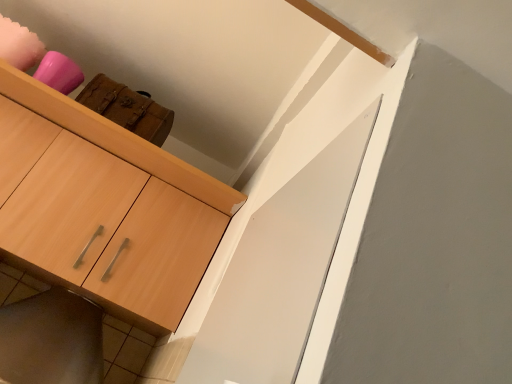
What do you see at coordinates (110, 212) in the screenshot?
I see `light wood cabinet at upper left` at bounding box center [110, 212].

This screenshot has height=384, width=512. I want to click on light wood cabinet at upper left, so click(110, 212).

At what (x,y) coordinates should I click in order to perform the action: click on wooden cabinet at lower left. Please return your answer as a coordinate pair (x, y). Looking at the image, I should click on (124, 351).

Describe the element at coordinates (124, 351) in the screenshot. The height and width of the screenshot is (384, 512). I see `wooden cabinet at lower left` at that location.

Image resolution: width=512 pixels, height=384 pixels. Find the location of `light wood cabinet at upper left`. light wood cabinet at upper left is located at coordinates (110, 212).

Can you confirm if wooden cabinet at lower left is positioned to the left of light wood cabinet at upper left?

No.

Which object is further away from the camera taking this photo, wooden cabinet at lower left or light wood cabinet at upper left?

Positioned behind is wooden cabinet at lower left.

Does point (1, 289) lie in front of point (128, 205)?

No, (1, 289) is behind (128, 205).

From the image's perspective, which one is positioned lower, wooden cabinet at lower left or light wood cabinet at upper left?

From the image's view, wooden cabinet at lower left is below.

From a real-world perspective, relative to light wood cabinet at upper left, is wooden cabinet at lower left vertically above or below?

From a real-world perspective, wooden cabinet at lower left is physically below light wood cabinet at upper left.

From the picture: Does wooden cabinet at lower left have a lesser width compared to light wood cabinet at upper left?

Indeed, wooden cabinet at lower left has a lesser width compared to light wood cabinet at upper left.

From their relative heights in the image, would you say wooden cabinet at lower left is taller or shorter than light wood cabinet at upper left?

In the image, wooden cabinet at lower left appears to be shorter than light wood cabinet at upper left.

Does wooden cabinet at lower left have a smaller size compared to light wood cabinet at upper left?

Yes.

Is light wood cabinet at upper left surrounded by wooden cabinet at lower left?

No, light wood cabinet at upper left is located outside of wooden cabinet at lower left.

Can you see wooden cabinet at lower left touching light wood cabinet at upper left?

No, wooden cabinet at lower left is not next to light wood cabinet at upper left.

Is wooden cabinet at lower left oriented towards light wood cabinet at upper left?

Yes, wooden cabinet at lower left is oriented towards light wood cabinet at upper left.

Locate an element on the screen. tile that is under the light wood cabinet at upper left (from a real-world perspective) is located at coordinates (124, 351).

Which object is positioned more to the right, light wood cabinet at upper left or wooden cabinet at lower left?

wooden cabinet at lower left.

Which is behind, light wood cabinet at upper left or wooden cabinet at lower left?

Positioned behind is wooden cabinet at lower left.

Which point is more distant from viewer, (35, 273) or (7, 271)?

The point (7, 271) is behind.

From the image's perspective, between light wood cabinet at upper left and wooden cabinet at lower left, which one is located above?

light wood cabinet at upper left is shown above in the image.

From a real-world perspective, between light wood cabinet at upper left and wooden cabinet at lower left, who is vertically higher?

From a 3D spatial view, light wood cabinet at upper left is above.

Between light wood cabinet at upper left and wooden cabinet at lower left, which one has larger width?

light wood cabinet at upper left.

Is light wood cabinet at upper left taller than wooden cabinet at lower left?

Yes.

Does light wood cabinet at upper left have a smaller size compared to wooden cabinet at lower left?

Actually, light wood cabinet at upper left might be larger than wooden cabinet at lower left.

Based on the photo, could wooden cabinet at lower left be considered to be inside light wood cabinet at upper left?

That's correct, wooden cabinet at lower left is inside light wood cabinet at upper left.

Is light wood cabinet at upper left positioned far away from wooden cabinet at lower left?

Actually, light wood cabinet at upper left and wooden cabinet at lower left are a little close together.

Is light wood cabinet at upper left oriented away from wooden cabinet at lower left?

Yes, light wood cabinet at upper left is facing away from wooden cabinet at lower left.

Where is `tile below the light wood cabinet at upper left (from the image's perspective)`? Image resolution: width=512 pixels, height=384 pixels. tile below the light wood cabinet at upper left (from the image's perspective) is located at coordinates (124, 351).

Find the location of `cabinetry above the wooden cabinet at lower left (from the image's perspective)`. cabinetry above the wooden cabinet at lower left (from the image's perspective) is located at coordinates (110, 212).

This screenshot has height=384, width=512. Identify the location of tile on the right of light wood cabinet at upper left. 124,351.